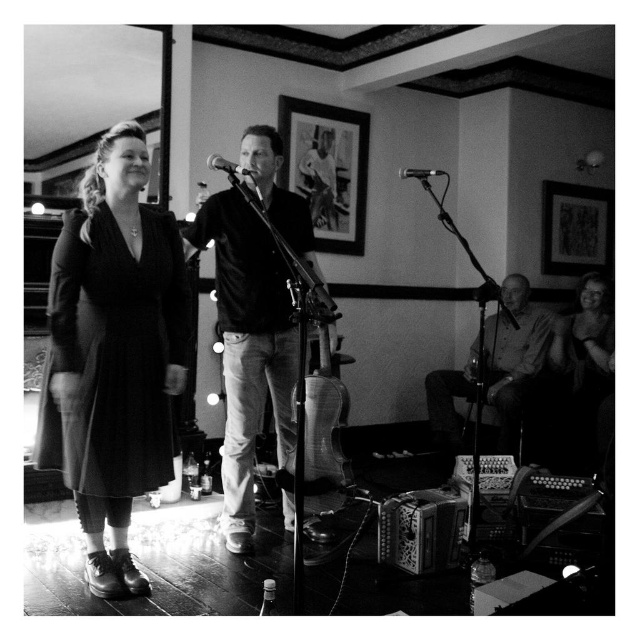
Question: Considering the relative positions of matte black shirt at center and wooden acoustic guitar at center in the image provided, where is matte black shirt at center located with respect to wooden acoustic guitar at center?

Choices:
 (A) left
 (B) right

Answer: (A)

Question: Is printed paper picture frame at upper center to the left of metallic silver microphone at upper center from the viewer's perspective?

Choices:
 (A) no
 (B) yes

Answer: (B)

Question: Which object appears closest to the camera in this image?

Choices:
 (A) metallic silver microphone at center
 (B) matte black dress at left
 (C) wooden acoustic guitar at center
 (D) metallic silver microphone at upper center

Answer: (C)

Question: Which of these objects is positioned farthest from the metallic silver microphone at upper center?

Choices:
 (A) metallic silver microphone at center
 (B) printed paper picture frame at upper center
 (C) matte black dress at left

Answer: (C)

Question: Which is farther from the metallic silver picture frame at upper right?

Choices:
 (A) matte black shirt at center
 (B) metallic silver microphone at upper center
 (C) printed paper picture frame at upper center
 (D) wooden acoustic guitar at center

Answer: (D)

Question: Is matte black shirt at center below smooth wooden guitar at lower right?

Choices:
 (A) yes
 (B) no

Answer: (B)